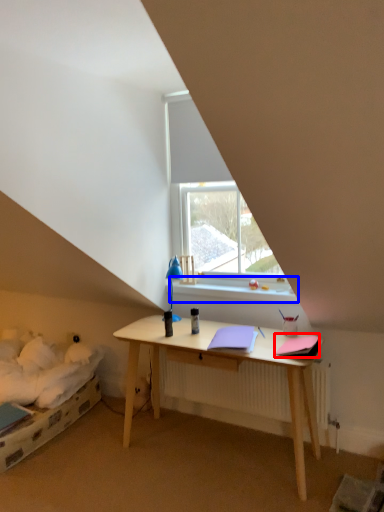
Question: Which object is closer to the camera taking this photo, notebook (highlighted by a red box) or window sill (highlighted by a blue box)?

Choices:
 (A) notebook
 (B) window sill

Answer: (A)